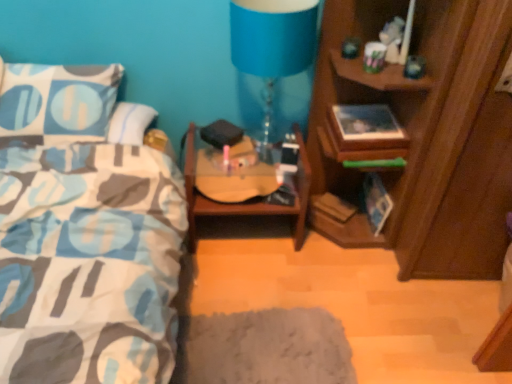
Question: From the image's perspective, would you say wooden guitar case at center is positioned over wooden cabinet at right?

Choices:
 (A) no
 (B) yes

Answer: (A)

Question: From a real-world perspective, is wooden guitar case at center positioned under wooden cabinet at right based on gravity?

Choices:
 (A) yes
 (B) no

Answer: (A)

Question: Is wooden guitar case at center with wooden cabinet at right?

Choices:
 (A) no
 (B) yes

Answer: (A)

Question: Is wooden guitar case at center outside wooden cabinet at right?

Choices:
 (A) yes
 (B) no

Answer: (A)

Question: Is wooden guitar case at center taller than wooden cabinet at right?

Choices:
 (A) yes
 (B) no

Answer: (B)

Question: Can you confirm if wooden guitar case at center is bigger than wooden cabinet at right?

Choices:
 (A) yes
 (B) no

Answer: (B)

Question: Considering the relative sizes of wooden guitar case at center and blue fabric lampshade at upper center in the image provided, is wooden guitar case at center bigger than blue fabric lampshade at upper center?

Choices:
 (A) no
 (B) yes

Answer: (B)

Question: Can you confirm if wooden guitar case at center is wider than blue fabric lampshade at upper center?

Choices:
 (A) no
 (B) yes

Answer: (B)

Question: Is wooden guitar case at center thinner than blue fabric lampshade at upper center?

Choices:
 (A) yes
 (B) no

Answer: (B)

Question: Does wooden guitar case at center have a greater height compared to blue fabric lampshade at upper center?

Choices:
 (A) yes
 (B) no

Answer: (B)

Question: From a real-world perspective, is wooden guitar case at center positioned over blue fabric lampshade at upper center based on gravity?

Choices:
 (A) yes
 (B) no

Answer: (B)

Question: Is wooden guitar case at center aimed at blue fabric lampshade at upper center?

Choices:
 (A) no
 (B) yes

Answer: (A)

Question: From a real-world perspective, is wooden cabinet at right over wooden guitar case at center?

Choices:
 (A) yes
 (B) no

Answer: (A)